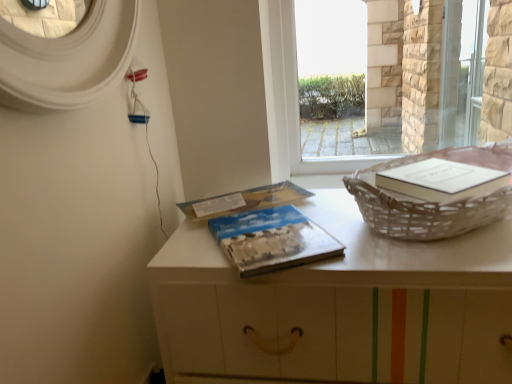
Question: From the image's perspective, is blue matte paper at center, which appears as the second paperback book when viewed from the front, above white matte table at center?

Choices:
 (A) yes
 (B) no

Answer: (A)

Question: From the image's perspective, does blue matte paper at center, the 1th paperback book when ordered from back to front, appear lower than white matte table at center?

Choices:
 (A) no
 (B) yes

Answer: (A)

Question: Can you confirm if blue matte paper at center, the 1th paperback book when ordered from back to front, is wider than white matte table at center?

Choices:
 (A) yes
 (B) no

Answer: (B)

Question: Is blue matte paper at center, the 1th paperback book when ordered from back to front, far from white matte table at center?

Choices:
 (A) no
 (B) yes

Answer: (A)

Question: Is blue matte paper at center, the 1th paperback book when ordered from back to front, facing away from white matte table at center?

Choices:
 (A) yes
 (B) no

Answer: (B)

Question: Is blue matte paper at center, the 1th paperback book when ordered from back to front, outside of white matte table at center?

Choices:
 (A) yes
 (B) no

Answer: (B)

Question: Is white matte table at center further to the viewer compared to transparent glass window at center?

Choices:
 (A) yes
 (B) no

Answer: (B)

Question: Is white matte table at center smaller than transparent glass window at center?

Choices:
 (A) no
 (B) yes

Answer: (A)

Question: From the image's perspective, is white matte table at center below transparent glass window at center?

Choices:
 (A) yes
 (B) no

Answer: (A)

Question: Could you tell me if white matte table at center is facing transparent glass window at center?

Choices:
 (A) no
 (B) yes

Answer: (A)

Question: Is transparent glass window at center inside white matte table at center?

Choices:
 (A) no
 (B) yes

Answer: (A)

Question: Is white matte table at center positioned with its back to transparent glass window at center?

Choices:
 (A) yes
 (B) no

Answer: (B)

Question: Is transparent glass screen door at upper right inside blue textured paper at center, marked as the second paperback book in a back-to-front arrangement?

Choices:
 (A) yes
 (B) no

Answer: (B)